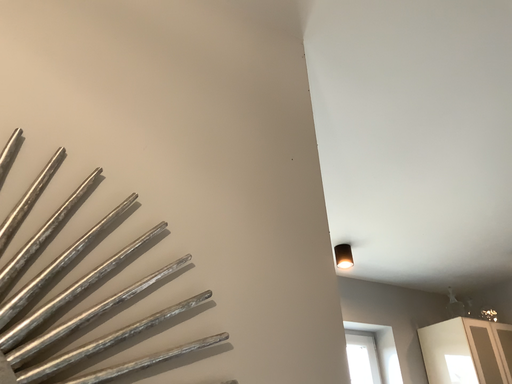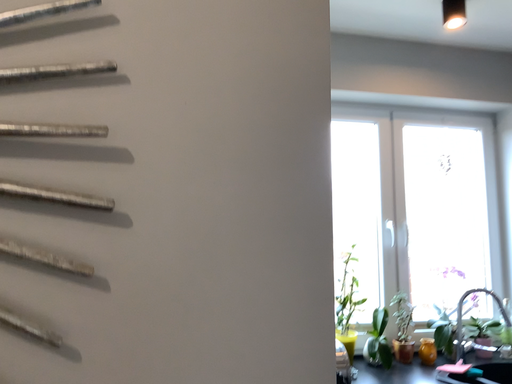
Question: Which way did the camera rotate in the video?

Choices:
 (A) rotated downward
 (B) rotated upward

Answer: (A)